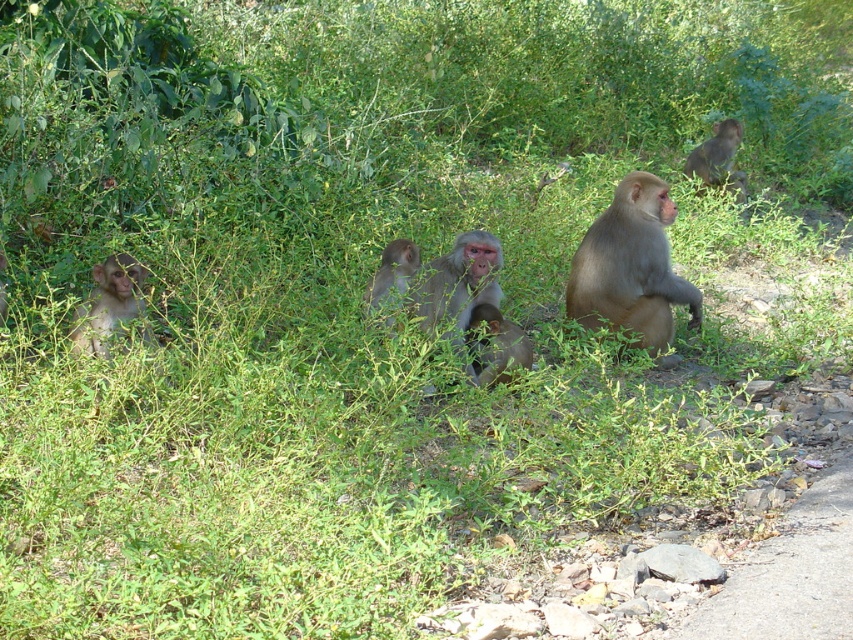
You are standing at the point marked as point (108, 304) in the image. Looking around, you see a brown fur monkey at lower left. What is the nearest object to you?

The nearest object to you is the brown fur monkey at lower left because the point (108, 304) corresponds to it.

You are a wildlife photographer trying to capture both the brown fur monkey at lower left and the brown furry monkey at center in a single frame. Based on their positions and sizes, which monkey would appear larger in your photo?

The brown fur monkey at lower left might appear larger in the photo since it is wider than the brown furry monkey at center according to their descriptions.

You are a wildlife photographer aiming to capture a photo of the monkeys. You notice two monkeys in the scene. One is the brown fur monkey at center and the other is the brown fur monkey at lower left. Which monkey should you focus on if you want to photograph the taller one?

The brown fur monkey at center is taller than the brown fur monkey at lower left, so you should focus on the brown fur monkey at center to photograph the taller one.